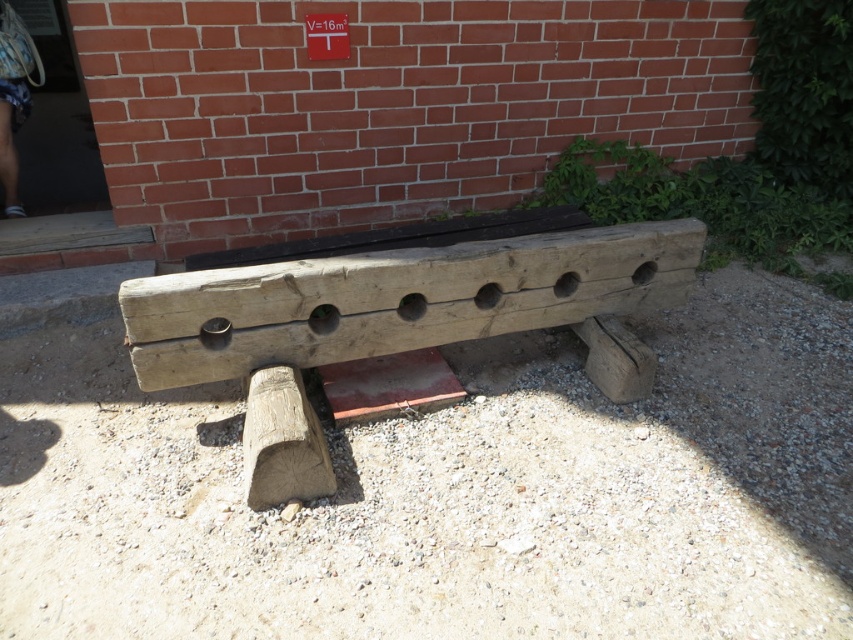
Does natural stone gravel at center have a greater height compared to natural wood bench at center?

No.

Is point (213, 433) positioned behind point (241, 301)?

Yes, point (213, 433) is behind point (241, 301).

Between point (35, 472) and point (317, 317), which one is positioned behind?

The point (317, 317) is behind.

The height and width of the screenshot is (640, 853). Identify the location of natural stone gravel at center. (451, 492).